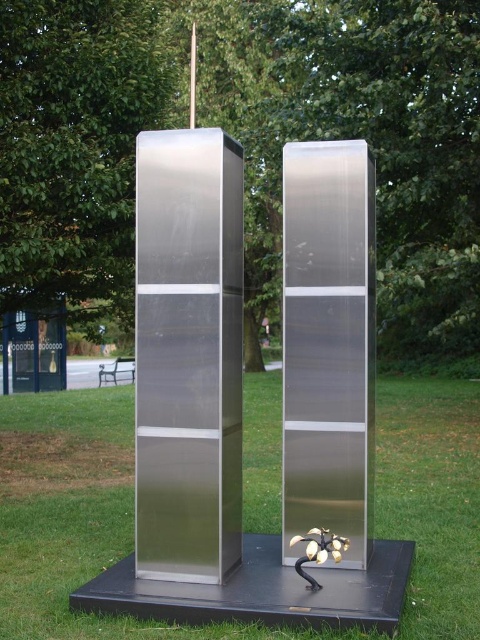
Question: Does green grass at center appear on the left side of satin metallic column at center?

Choices:
 (A) yes
 (B) no

Answer: (B)

Question: Does green grass at center come in front of satin silver sculpture at center?

Choices:
 (A) yes
 (B) no

Answer: (A)

Question: Among these objects, which one is nearest to the camera?

Choices:
 (A) satin metallic column at center
 (B) green grass at center
 (C) satin silver sculpture at center

Answer: (B)

Question: Among these points, which one is nearest to the camera?

Choices:
 (A) (153, 424)
 (B) (322, 394)

Answer: (A)

Question: Estimate the real-world distances between objects in this image. Which object is farther from the satin metallic column at center?

Choices:
 (A) satin silver sculpture at center
 (B) green grass at center

Answer: (B)

Question: Can you confirm if satin metallic column at center is smaller than satin silver sculpture at center?

Choices:
 (A) no
 (B) yes

Answer: (A)